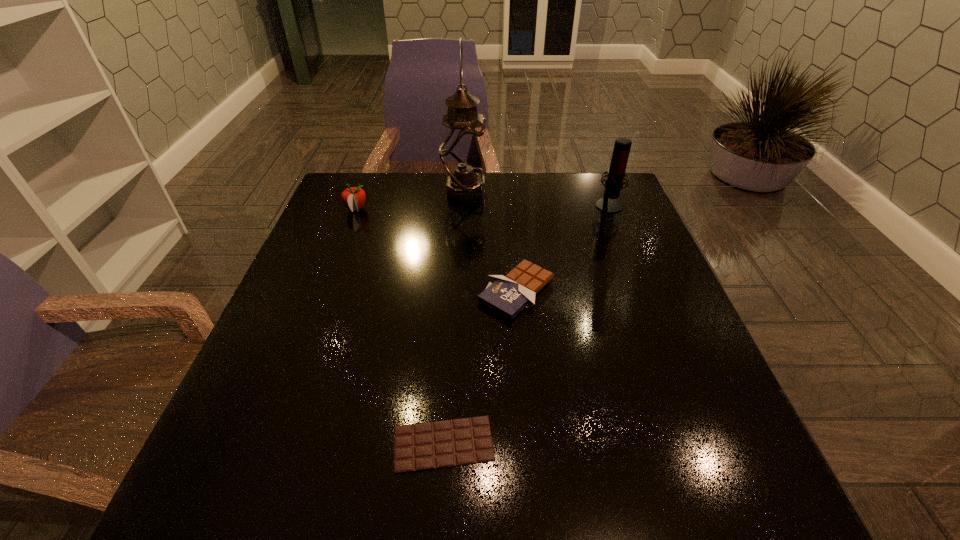
The image size is (960, 540). In order to click on object that stands as the closest to the oil lamp in this screenshot , I will do `click(353, 198)`.

Locate an element on the screen. This screenshot has width=960, height=540. vacant space that satisfies the following two spatial constraints: 1. on the back side of the rightmost object; 2. on the right side of the shorter chocolate bar is located at coordinates (459, 204).

Find the location of a particular element. Image resolution: width=960 pixels, height=540 pixels. free location that satisfies the following two spatial constraints: 1. on the front side of the tallest object; 2. on the right side of the fourth tallest object is located at coordinates (459, 291).

Where is `free location that satisfies the following two spatial constraints: 1. on the back side of the fourth tallest object; 2. on the left side of the shorter chocolate bar`? Image resolution: width=960 pixels, height=540 pixels. free location that satisfies the following two spatial constraints: 1. on the back side of the fourth tallest object; 2. on the left side of the shorter chocolate bar is located at coordinates (453, 291).

You are a GUI agent. You are given a task and a screenshot of the screen. Output one action in this format:
    pyautogui.click(x=<x>, y=<y>)
    Task: Click on the free region that satisfies the following two spatial constraints: 1. on the front side of the second tallest object; 2. on the right side of the tallest object
    
    Given the screenshot: What is the action you would take?
    pyautogui.click(x=464, y=204)